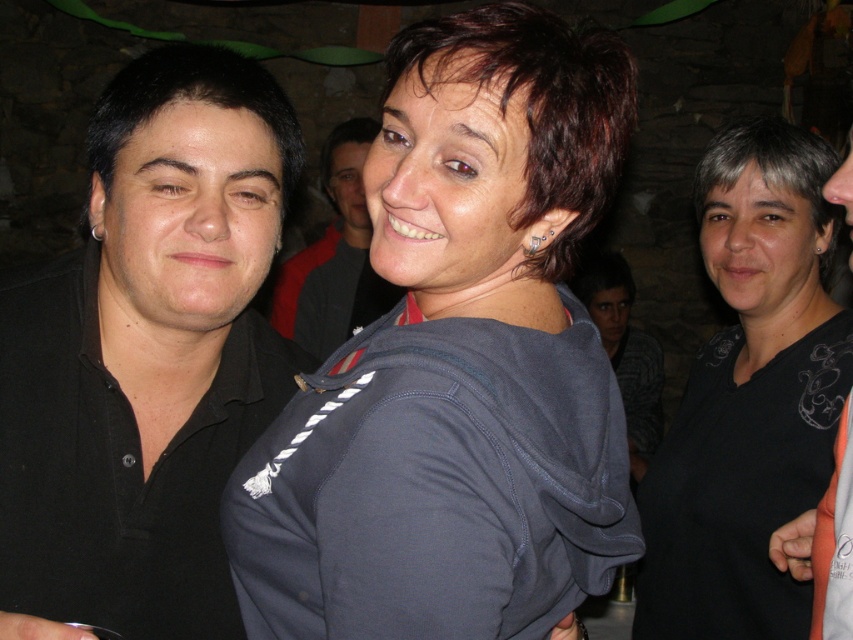
Which is behind, point (804, 433) or point (376, 125)?

Point (376, 125)

The image size is (853, 640). Describe the element at coordinates (749, 396) in the screenshot. I see `black matte shirt at center` at that location.

Who is more distant from viewer, (718, 260) or (334, 248)?

The point (334, 248) is more distant.

Find the location of a particular element. The height and width of the screenshot is (640, 853). black matte shirt at center is located at coordinates (749, 396).

Can you confirm if black matte shirt at left is positioned to the right of matte black shirt at upper left?

In fact, black matte shirt at left is to the left of matte black shirt at upper left.

Who is more forward, (125, 70) or (337, 160)?

Point (125, 70) is in front.

What do you see at coordinates (146, 355) in the screenshot?
I see `black matte shirt at left` at bounding box center [146, 355].

Locate an element on the screen. black matte shirt at left is located at coordinates (146, 355).

Does black matte shirt at left appear on the right side of gray striped sweater at center?

In fact, black matte shirt at left is to the left of gray striped sweater at center.

Is point (229, 237) in front of point (634, 422)?

Yes, it is.

Find the location of a particular element. black matte shirt at left is located at coordinates 146,355.